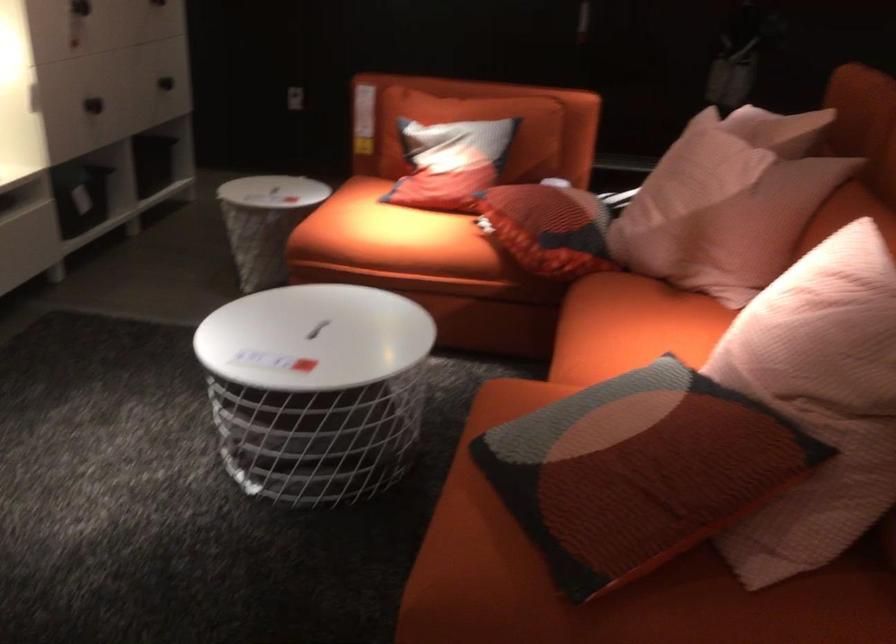
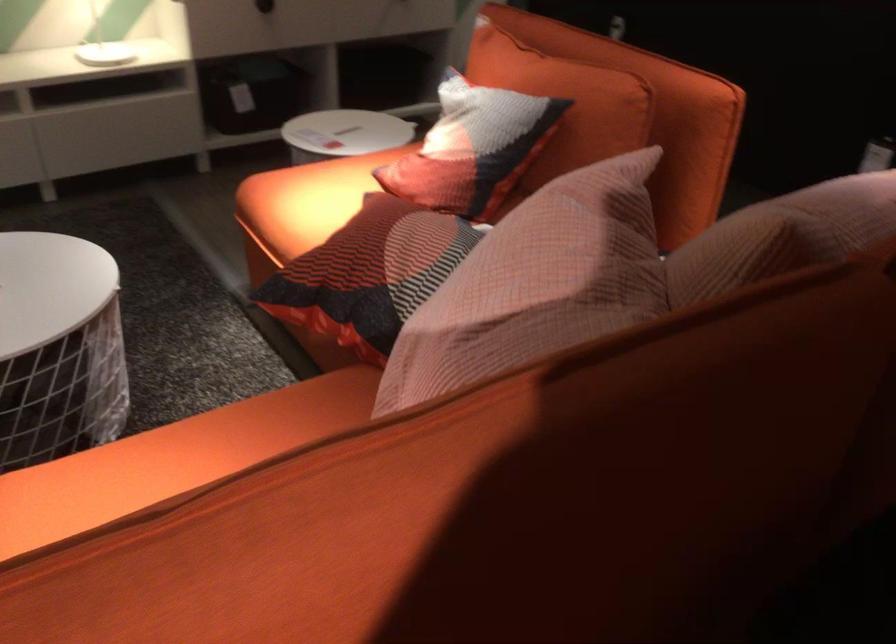
Locate, in the second image, the point that corresponds to point (108, 111) in the first image.

(264, 6)